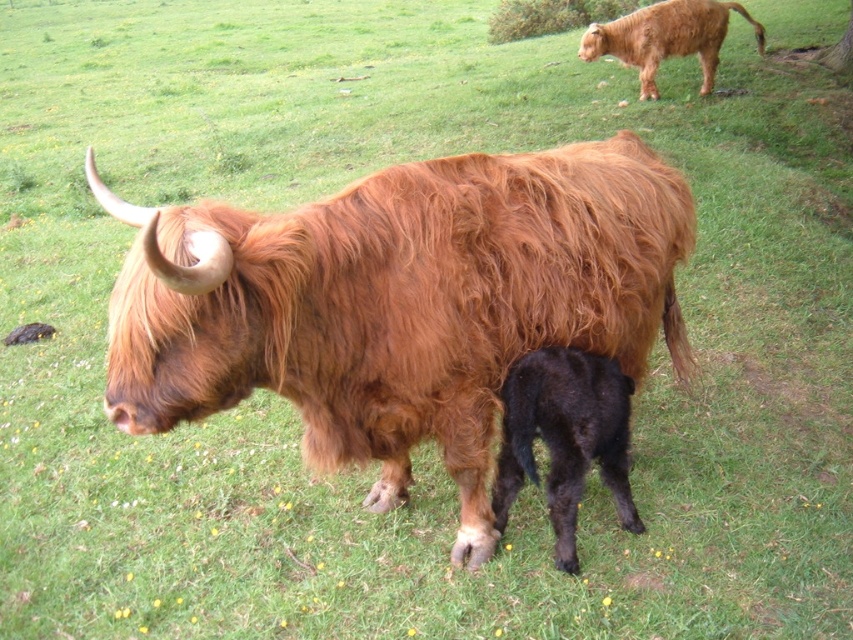
Between shaggy brown yak at center and brown shaggy yak at upper right, which one is positioned higher?

Positioned higher is brown shaggy yak at upper right.

Is point (227, 232) positioned behind point (587, 33)?

No, (227, 232) is closer to viewer.

Which is in front, point (387, 275) or point (674, 24)?

Point (387, 275) is more forward.

Locate an element on the screen. This screenshot has width=853, height=640. shaggy brown yak at center is located at coordinates (399, 304).

Which is more to the right, shaggy brown yak at center or black fuzzy calf at lower center?

Positioned to the right is black fuzzy calf at lower center.

Between point (482, 275) and point (578, 458), which one is positioned in front?

Point (482, 275) is more forward.

Find the location of a particular element. Image resolution: width=853 pixels, height=640 pixels. shaggy brown yak at center is located at coordinates (399, 304).

Which is above, black fuzzy calf at lower center or brown shaggy yak at upper right?

Positioned higher is brown shaggy yak at upper right.

Who is taller, black fuzzy calf at lower center or brown shaggy yak at upper right?

brown shaggy yak at upper right

Find the location of `black fuzzy calf at lower center`. black fuzzy calf at lower center is located at coordinates (566, 436).

Find the location of `black fuzzy calf at lower center`. black fuzzy calf at lower center is located at coordinates (566, 436).